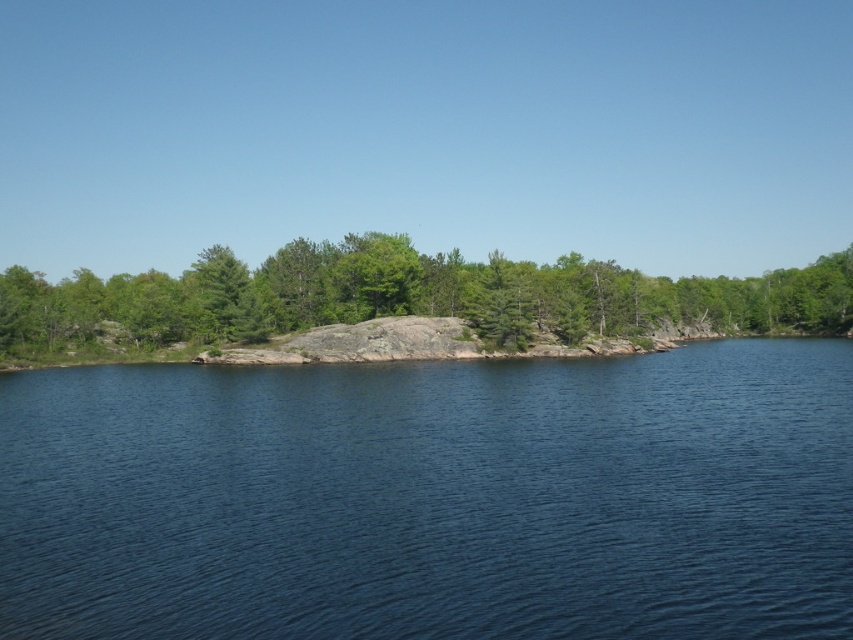
Is blue water at center further to camera compared to green textured rock at center?

That is False.

Is blue water at center to the left of green textured rock at center from the viewer's perspective?

Incorrect, blue water at center is not on the left side of green textured rock at center.

Between point (786, 586) and point (62, 304), which one is positioned in front?

Point (786, 586) is in front.

Locate an element on the screen. blue water at center is located at coordinates (433, 497).